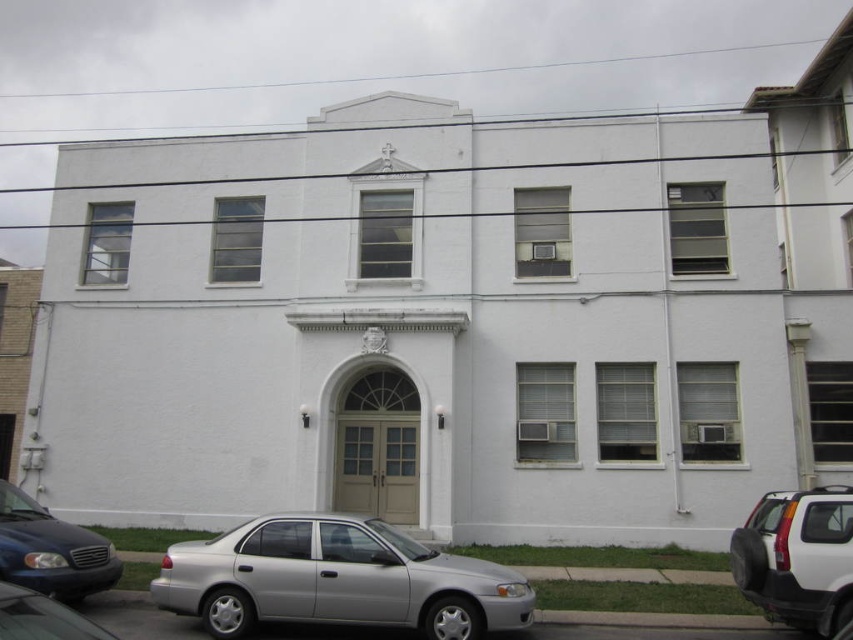
Question: Which object is the farthest from the silver metallic sedan at center?

Choices:
 (A) matte black sedan at lower left
 (B) white matte suv at right
 (C) shiny black sedan at lower left

Answer: (C)

Question: Is silver metallic sedan at center bigger than white matte suv at right?

Choices:
 (A) no
 (B) yes

Answer: (B)

Question: Can you confirm if matte black sedan at lower left is positioned to the left of shiny black sedan at lower left?

Choices:
 (A) no
 (B) yes

Answer: (B)

Question: Does silver metallic sedan at center appear on the left side of shiny black sedan at lower left?

Choices:
 (A) no
 (B) yes

Answer: (A)

Question: Which point appears closest to the camera in this image?

Choices:
 (A) (15, 592)
 (B) (228, 621)
 (C) (71, 524)
 (D) (775, 496)

Answer: (A)

Question: Which is nearer to the white matte suv at right?

Choices:
 (A) shiny black sedan at lower left
 (B) matte black sedan at lower left
 (C) silver metallic sedan at center

Answer: (C)